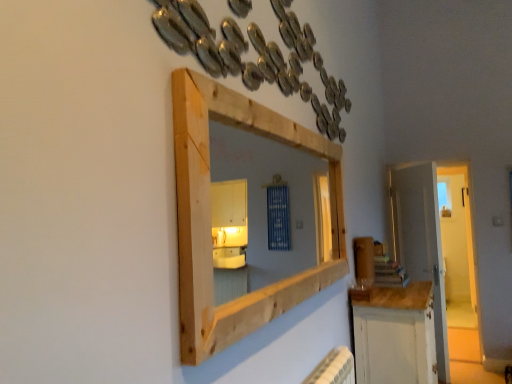
Question: Is white painted wood cabinet at lower right taller or shorter than natural wood medicine cabinet at upper center?

Choices:
 (A) short
 (B) tall

Answer: (B)

Question: Visually, is white painted wood cabinet at lower right positioned to the left or to the right of natural wood medicine cabinet at upper center?

Choices:
 (A) left
 (B) right

Answer: (B)

Question: Which of these objects is positioned closest to the natural wood medicine cabinet at upper center?

Choices:
 (A) white wooden door at right
 (B) white painted wood cabinet at lower right

Answer: (B)

Question: Which object is positioned farthest from the white painted wood cabinet at lower right?

Choices:
 (A) natural wood medicine cabinet at upper center
 (B) white wooden door at right

Answer: (B)